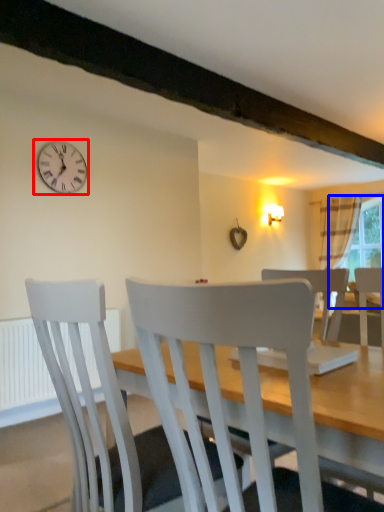
Question: Which point is closer to the camera, wall clock (highlighted by a red box) or window screen (highlighted by a blue box)?

Choices:
 (A) wall clock
 (B) window screen

Answer: (A)